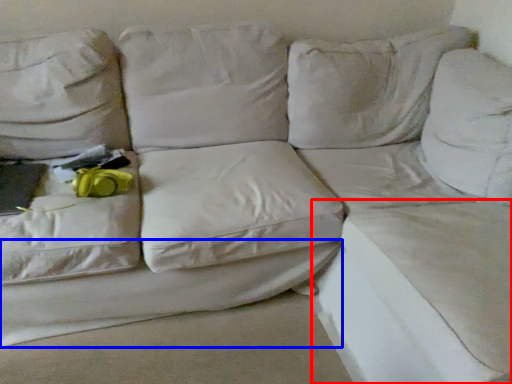
Question: Which of the following is the farthest to the observer, sheet (highlighted by a red box) or sheet (highlighted by a blue box)?

Choices:
 (A) sheet
 (B) sheet

Answer: (B)